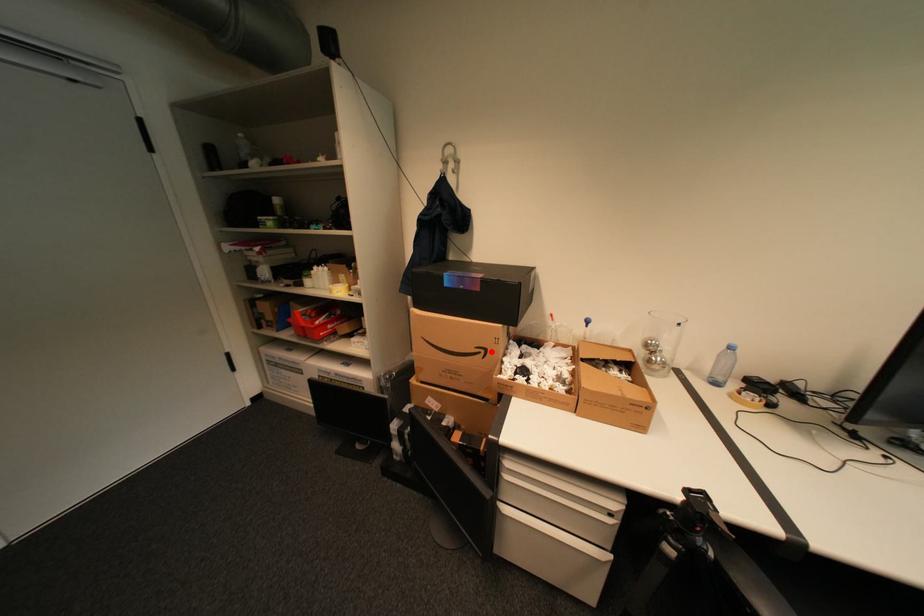
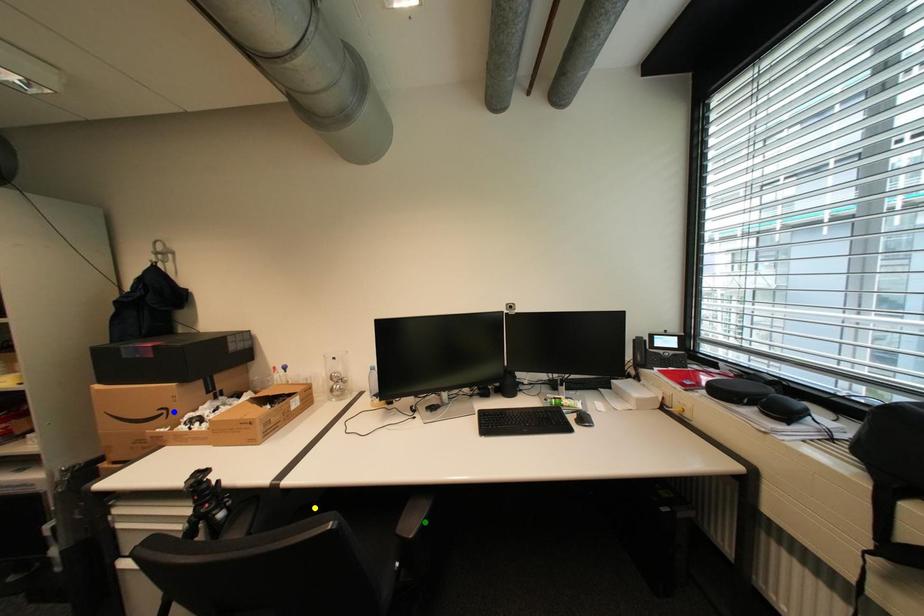
Question: I am providing you with two images of the same scene from different viewpoints. A red point is marked on the first image. You are given multiple points on the second image. In image 2, which mark is for the same physical point as the one in image 1?

Choices:
 (A) yellow point
 (B) blue point
 (C) green point

Answer: (B)